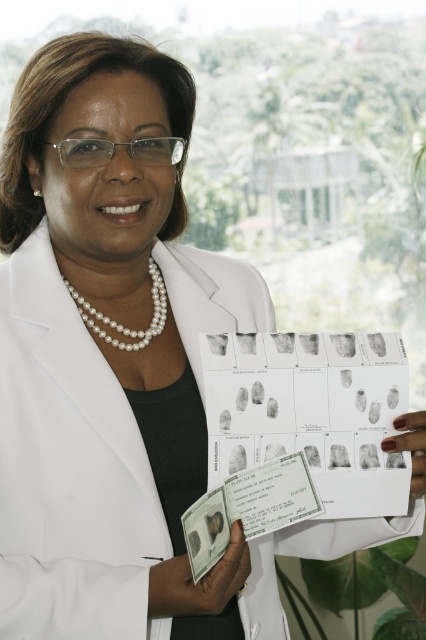
Question: Is pearl necklace at center thinner than nail polish painted fingernails at center?

Choices:
 (A) yes
 (B) no

Answer: (B)

Question: Does pearl necklace at center appear on the right side of nail polish painted fingernails at center?

Choices:
 (A) yes
 (B) no

Answer: (B)

Question: Does white paper at center have a larger size compared to pearl necklace at center?

Choices:
 (A) no
 (B) yes

Answer: (A)

Question: Which object is positioned closest to the white paper at center?

Choices:
 (A) pearl necklace at center
 (B) nail polish painted fingernails at center

Answer: (B)

Question: Among these points, which one is nearest to the camera?

Choices:
 (A) (411, 413)
 (B) (170, 584)
 (C) (158, 276)

Answer: (B)

Question: Among these points, which one is nearest to the camera?

Choices:
 (A) (213, 586)
 (B) (150, 323)

Answer: (A)